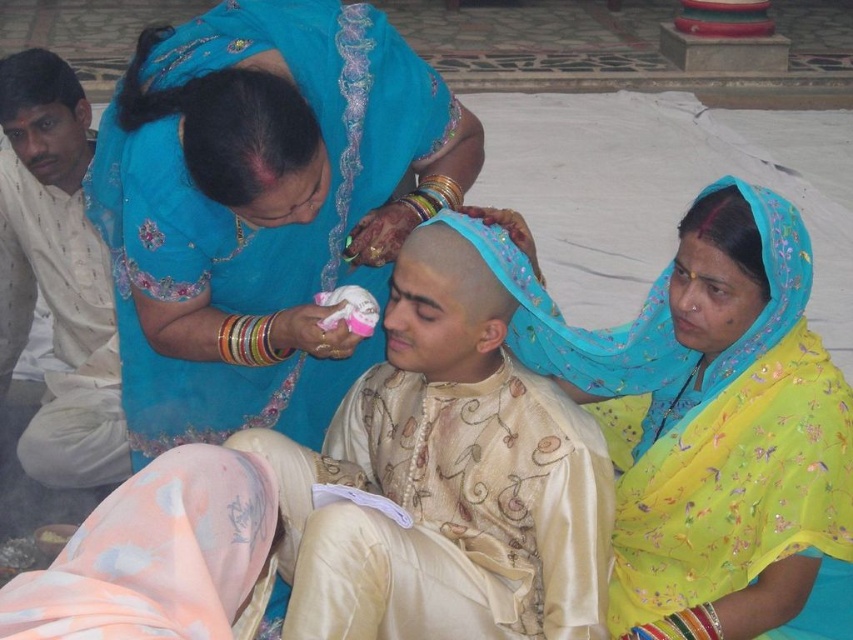
Question: Is yellow floral saree at center smaller than matte blue saree at left?

Choices:
 (A) yes
 (B) no

Answer: (B)

Question: Which of the following is the closest to the observer?

Choices:
 (A) matte blue saree at left
 (B) yellow floral saree at center
 (C) blue silk saree at upper left

Answer: (C)

Question: Is blue silk saree at upper left thinner than yellow floral saree at center?

Choices:
 (A) yes
 (B) no

Answer: (B)

Question: Is yellow floral saree at center positioned behind matte blue saree at left?

Choices:
 (A) yes
 (B) no

Answer: (B)

Question: Estimate the real-world distances between objects in this image. Which object is farther from the yellow floral saree at center?

Choices:
 (A) matte blue saree at left
 (B) blue silk saree at upper left

Answer: (A)

Question: Estimate the real-world distances between objects in this image. Which object is closer to the matte blue saree at left?

Choices:
 (A) yellow floral saree at center
 (B) blue silk saree at upper left

Answer: (B)